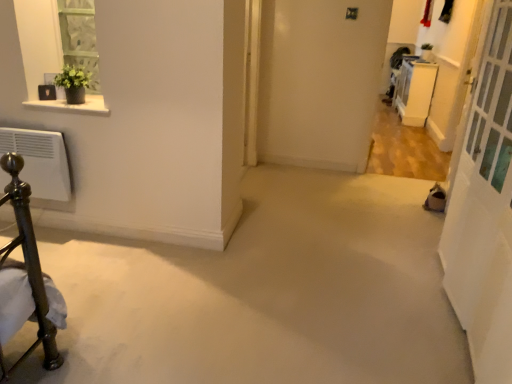
In order to face white glossy cabinet at upper right, should I rotate leftwards or rightwards?

Rotate your view right by about 19.989°.

Locate an element on the screen. The width and height of the screenshot is (512, 384). white marble shelf at upper left is located at coordinates (73, 105).

Does point (40, 101) appear closer or farther from the camera than point (478, 267)?

Point (40, 101) appears to be farther away from the viewer than point (478, 267).

Is white marble shelf at upper left facing towards white glass screen door at right?

No, white marble shelf at upper left is not aimed at white glass screen door at right.

In the image, there is a white glass screen door at right. Where is `window sill above it (from the image's perspective)`? The width and height of the screenshot is (512, 384). window sill above it (from the image's perspective) is located at coordinates (73, 105).

Visually, is white marble shelf at upper left positioned to the left or to the right of white glossy cabinet at upper right?

white marble shelf at upper left is positioned on white glossy cabinet at upper right's left side.

Is white marble shelf at upper left bigger or smaller than white glossy cabinet at upper right?

Considering their sizes, white marble shelf at upper left takes up less space than white glossy cabinet at upper right.

How many degrees apart are the facing directions of white marble shelf at upper left and white glossy cabinet at upper right?

white marble shelf at upper left and white glossy cabinet at upper right are facing 90.1 degrees away from each other.

From a real-world perspective, relative to white glossy cabinet at upper right, is white marble shelf at upper left vertically above or below?

white marble shelf at upper left is above white glossy cabinet at upper right.

Is white glass screen door at right to the left of white marble shelf at upper left from the viewer's perspective?

No, white glass screen door at right is not to the left of white marble shelf at upper left.

Is white glass screen door at right inside the boundaries of white marble shelf at upper left, or outside?

white glass screen door at right is located beyond the bounds of white marble shelf at upper left.

Does white glass screen door at right have a greater height compared to white marble shelf at upper left?

Yes.

Could you tell me if white glass screen door at right is turned towards white marble shelf at upper left?

Yes, white glass screen door at right is facing white marble shelf at upper left.

Is white glossy cabinet at upper right oriented away from white glass screen door at right?

No, white glossy cabinet at upper right is not facing away from white glass screen door at right.

From the image's perspective, which object appears higher, white glossy cabinet at upper right or white glass screen door at right?

white glossy cabinet at upper right is shown above in the image.

From a real-world perspective, which object stands above the other?

In real-world perspective, white glass screen door at right is above.

Looking at this image, from a real-world perspective, is white glossy cabinet at upper right beneath white marble shelf at upper left?

Indeed, from a real-world perspective, white glossy cabinet at upper right is positioned beneath white marble shelf at upper left.

Is white glossy cabinet at upper right outside of white marble shelf at upper left?

Indeed, white glossy cabinet at upper right is completely outside white marble shelf at upper left.

Does white glossy cabinet at upper right lie in front of white marble shelf at upper left?

That is False.

From their relative heights in the image, would you say white glossy cabinet at upper right is taller or shorter than white marble shelf at upper left?

Clearly, white glossy cabinet at upper right is taller compared to white marble shelf at upper left.

Which of these two, white glass screen door at right or white glossy cabinet at upper right, is bigger?

white glass screen door at right.

Would you say white glass screen door at right is outside white glossy cabinet at upper right?

Yes, white glass screen door at right is not within white glossy cabinet at upper right.

In order to click on furniture that appears on the right of white glass screen door at right in this screenshot , I will do `click(414, 90)`.

Does white glass screen door at right touch white glossy cabinet at upper right?

No, white glass screen door at right is not with white glossy cabinet at upper right.

At what (x,y) coordinates should I click in order to perform the action: click on window sill on the left side of white glass screen door at right. Please return your answer as a coordinate pair (x, y). Looking at the image, I should click on (73, 105).

Where is `window sill below the white glossy cabinet at upper right (from the image's perspective)`? window sill below the white glossy cabinet at upper right (from the image's perspective) is located at coordinates (73, 105).

Looking at the image, which one is located further to white glass screen door at right, white marble shelf at upper left or white glossy cabinet at upper right?

The object further to white glass screen door at right is white glossy cabinet at upper right.

When comparing their distances from white glass screen door at right, does white glossy cabinet at upper right or white marble shelf at upper left seem closer?

white marble shelf at upper left lies closer to white glass screen door at right than the other object.

From the image, which object appears to be nearer to white marble shelf at upper left, white glass screen door at right or white glossy cabinet at upper right?

white glass screen door at right.

Based on their spatial positions, is white marble shelf at upper left or white glass screen door at right closer to white glossy cabinet at upper right?

white glass screen door at right is closer to white glossy cabinet at upper right.

Considering their positions, is white glass screen door at right positioned further to white glossy cabinet at upper right than white marble shelf at upper left?

white marble shelf at upper left.

Based on the photo, when comparing their distances from white marble shelf at upper left, does white glossy cabinet at upper right or white glass screen door at right seem further?

white glossy cabinet at upper right lies further to white marble shelf at upper left than the other object.

The width and height of the screenshot is (512, 384). Identify the location of window sill between white glass screen door at right and white glossy cabinet at upper right from front to back. (73, 105).